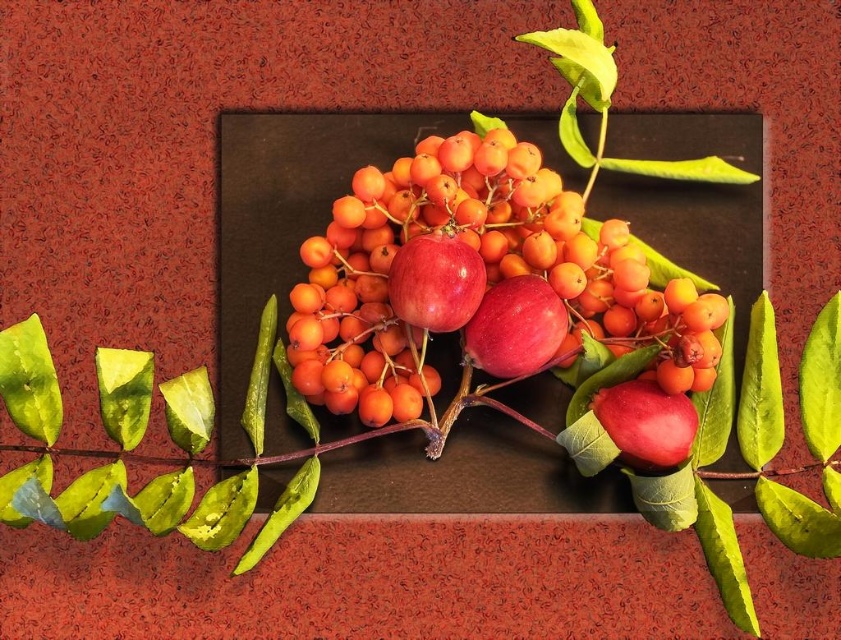
You are an artist planning to paint this still life. You need to know the position of the glossy red apples at center relative to the berries. Can you tell me if they are placed to the left or right of the berries?

The glossy red apples at center are located at point (485,269), which indicates their position relative to the berries. However, without specific coordinate reference points for the berries, I cannot determine if they are to the left or right. Please provide more details about the berries position.

In the scene shown: You are a fruit vendor who needs to place a price tag on the glossy red apples at center. If your hand is 30 inches away from the apples, can you reach them to attach the tag?

The glossy red apples at center and viewer are 31.05 inches apart. Since your hand is only 30 inches away, you cannot reach them to attach the tag.